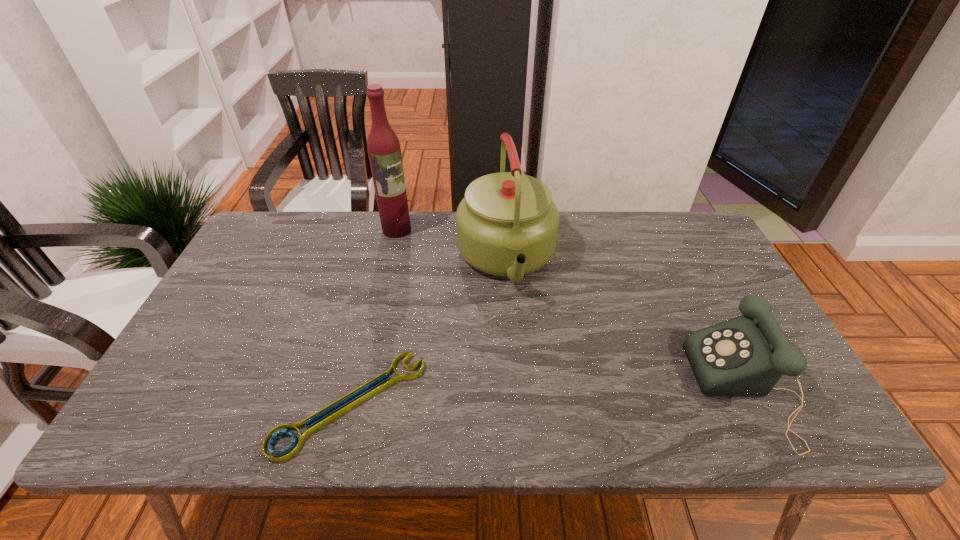
Where is `vacant space on the desktop that is between the wrench and the rightmost object and is positioned at the spout of the kettle`? The width and height of the screenshot is (960, 540). vacant space on the desktop that is between the wrench and the rightmost object and is positioned at the spout of the kettle is located at coordinates (538, 396).

Locate an element on the screen. Image resolution: width=960 pixels, height=540 pixels. free spot on the desktop that is between the wrench and the telephone and is positioned on the label of the tallest object is located at coordinates (502, 398).